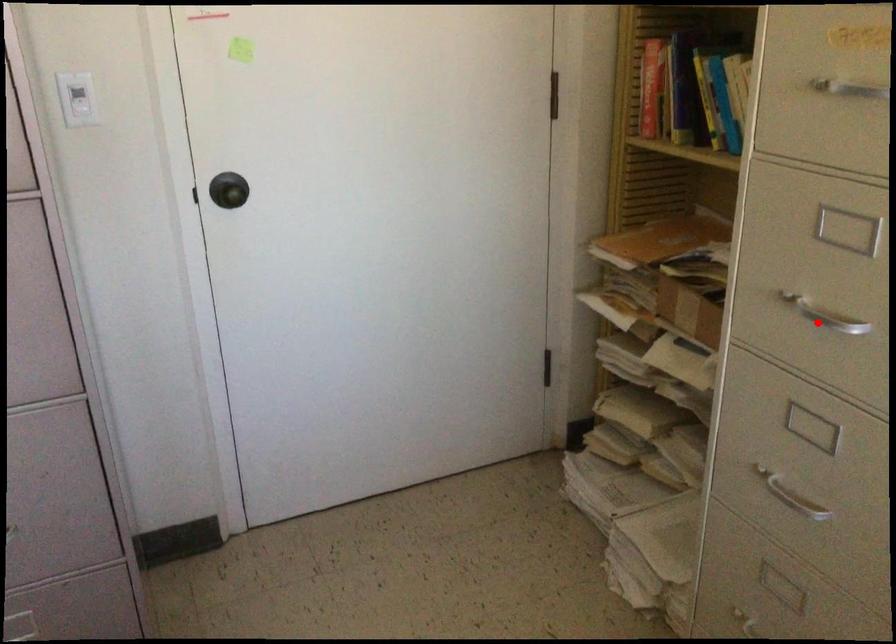
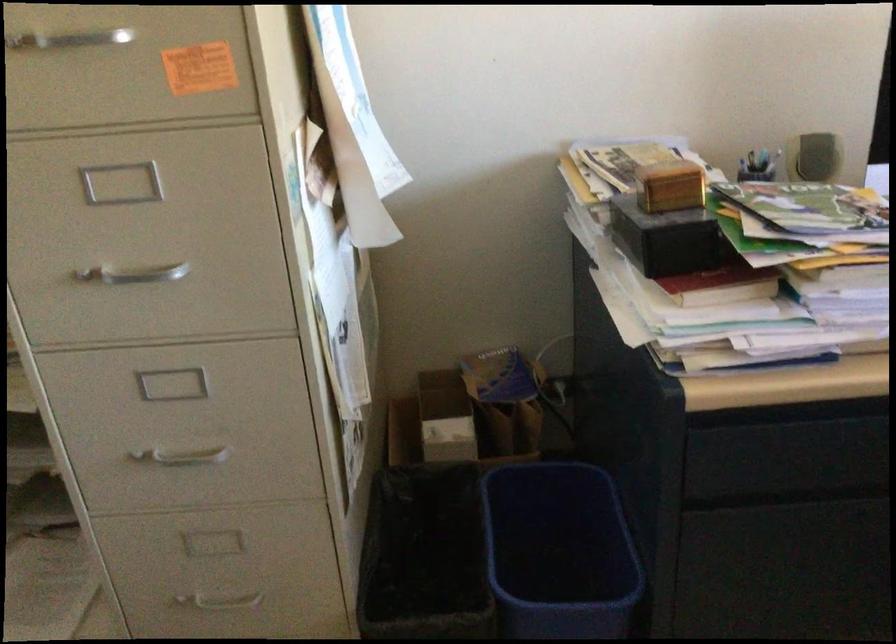
Where in the second image is the point corresponding to the highlighted location from the first image?

(134, 274)